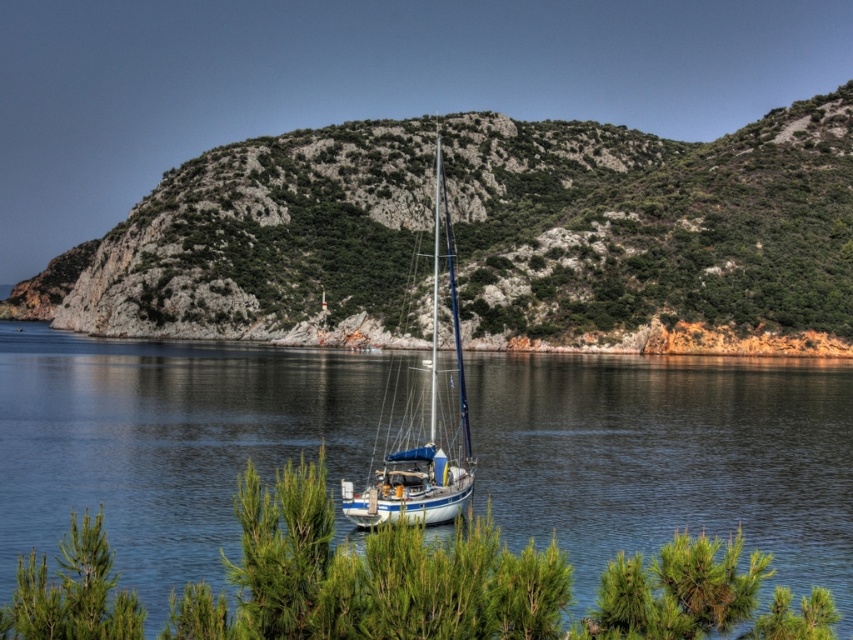
Question: Which point appears farthest from the camera in this image?

Choices:
 (A) (419, 460)
 (B) (614, 256)

Answer: (B)

Question: Which of the following is the closest to the observer?

Choices:
 (A) (524, 257)
 (B) (244, 349)

Answer: (B)

Question: Is the position of green rocky hillside at center less distant than that of blue water at center?

Choices:
 (A) no
 (B) yes

Answer: (A)

Question: Which point is farther to the camera?

Choices:
 (A) (416, 413)
 (B) (532, 148)

Answer: (B)

Question: Does green rocky hillside at center have a smaller size compared to white glossy sailboat at center?

Choices:
 (A) no
 (B) yes

Answer: (A)

Question: Does green rocky hillside at center appear on the left side of white glossy sailboat at center?

Choices:
 (A) no
 (B) yes

Answer: (B)